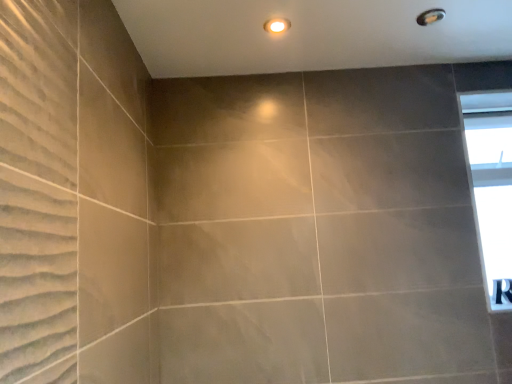
Describe the element at coordinates (277, 25) in the screenshot. I see `matte white light fixture at upper center` at that location.

Measure the distance between transparent glass window at upper right and camera.

The distance of transparent glass window at upper right from camera is 5.43 feet.

At what (x,y) coordinates should I click in order to perform the action: click on matte white light fixture at upper center. Please return your answer as a coordinate pair (x, y). Looking at the image, I should click on (277, 25).

From the image's perspective, which one is positioned higher, matte gray shower at upper right or matte white light fixture at upper center?

matte gray shower at upper right, from the image's perspective.

Between matte gray shower at upper right and matte white light fixture at upper center, which one has smaller width?

With smaller width is matte white light fixture at upper center.

This screenshot has height=384, width=512. What are the coordinates of `shower above the matte white light fixture at upper center (from the image's perspective)` in the screenshot? It's located at (430, 16).

In the scene shown: Does matte gray shower at upper right have a larger size compared to matte white light fixture at upper center?

Incorrect, matte gray shower at upper right is not larger than matte white light fixture at upper center.

From a real-world perspective, who is located higher, matte gray shower at upper right or transparent glass window at upper right?

matte gray shower at upper right is physically above.

Considering the sizes of objects matte gray shower at upper right and transparent glass window at upper right in the image provided, who is taller, matte gray shower at upper right or transparent glass window at upper right?

transparent glass window at upper right is taller.

Is point (443, 14) positioned behind point (487, 291)?

No, it is in front of (487, 291).

Where is `window directly beneath the matte gray shower at upper right (from a real-world perspective)`? window directly beneath the matte gray shower at upper right (from a real-world perspective) is located at coordinates (490, 187).

How much distance is there between matte white light fixture at upper center and matte gray shower at upper right?

matte white light fixture at upper center is 17.84 inches from matte gray shower at upper right.

Is matte gray shower at upper right located within matte white light fixture at upper center?

No, matte white light fixture at upper center does not contain matte gray shower at upper right.

Does point (290, 25) appear closer or farther from the camera than point (432, 19)?

Point (290, 25) is closer to the camera than point (432, 19).

Considering the relative sizes of matte white light fixture at upper center and matte gray shower at upper right in the image provided, is matte white light fixture at upper center thinner than matte gray shower at upper right?

Yes.

From a real-world perspective, between transparent glass window at upper right and matte white light fixture at upper center, who is vertically higher?

matte white light fixture at upper center is physically above.

Is matte white light fixture at upper center a part of transparent glass window at upper right?

No, transparent glass window at upper right does not contain matte white light fixture at upper center.

How different are the orientations of transparent glass window at upper right and matte white light fixture at upper center in degrees?

The facing directions of transparent glass window at upper right and matte white light fixture at upper center are 3.66 degrees apart.

How far apart are transparent glass window at upper right and matte gray shower at upper right?

transparent glass window at upper right and matte gray shower at upper right are 37.22 inches apart.

Can you see transparent glass window at upper right touching matte gray shower at upper right?

No, transparent glass window at upper right is not in contact with matte gray shower at upper right.

Is transparent glass window at upper right situated inside matte gray shower at upper right or outside?

transparent glass window at upper right is not inside matte gray shower at upper right, it's outside.

Considering the sizes of transparent glass window at upper right and matte gray shower at upper right in the image, is transparent glass window at upper right bigger or smaller than matte gray shower at upper right?

Clearly, transparent glass window at upper right is larger in size than matte gray shower at upper right.

From the image's perspective, which is below, matte white light fixture at upper center or transparent glass window at upper right?

transparent glass window at upper right appears lower in the image.

Is matte white light fixture at upper center touching transparent glass window at upper right?

matte white light fixture at upper center and transparent glass window at upper right are clearly separated.

Looking at this image, is matte white light fixture at upper center situated inside transparent glass window at upper right or outside?

matte white light fixture at upper center is not inside transparent glass window at upper right, it's outside.

From a real-world perspective, between matte white light fixture at upper center and transparent glass window at upper right, who is vertically lower?

transparent glass window at upper right.

Identify the location of lighting below the matte gray shower at upper right (from the image's perspective). (277, 25).

At what (x,y) coordinates should I click in order to perform the action: click on window located underneath the matte gray shower at upper right (from a real-world perspective). Please return your answer as a coordinate pair (x, y). Looking at the image, I should click on (490, 187).

When comparing their distances from transparent glass window at upper right, does matte gray shower at upper right or matte white light fixture at upper center seem closer?

Based on the image, matte gray shower at upper right appears to be nearer to transparent glass window at upper right.

Based on their spatial positions, is matte white light fixture at upper center or transparent glass window at upper right closer to matte gray shower at upper right?

Among the two, matte white light fixture at upper center is located nearer to matte gray shower at upper right.

Based on their spatial positions, is matte white light fixture at upper center or matte gray shower at upper right further from transparent glass window at upper right?

The object further to transparent glass window at upper right is matte white light fixture at upper center.

Based on their spatial positions, is transparent glass window at upper right or matte white light fixture at upper center closer to matte gray shower at upper right?

Among the two, matte white light fixture at upper center is located nearer to matte gray shower at upper right.

When comparing their distances from matte white light fixture at upper center, does matte gray shower at upper right or transparent glass window at upper right seem closer?

matte gray shower at upper right.

Looking at the image, which one is located further to matte white light fixture at upper center, transparent glass window at upper right or matte gray shower at upper right?

The object further to matte white light fixture at upper center is transparent glass window at upper right.

This screenshot has width=512, height=384. Find the location of `shower located between matte white light fixture at upper center and transparent glass window at upper right in the left-right direction`. shower located between matte white light fixture at upper center and transparent glass window at upper right in the left-right direction is located at coordinates (430, 16).